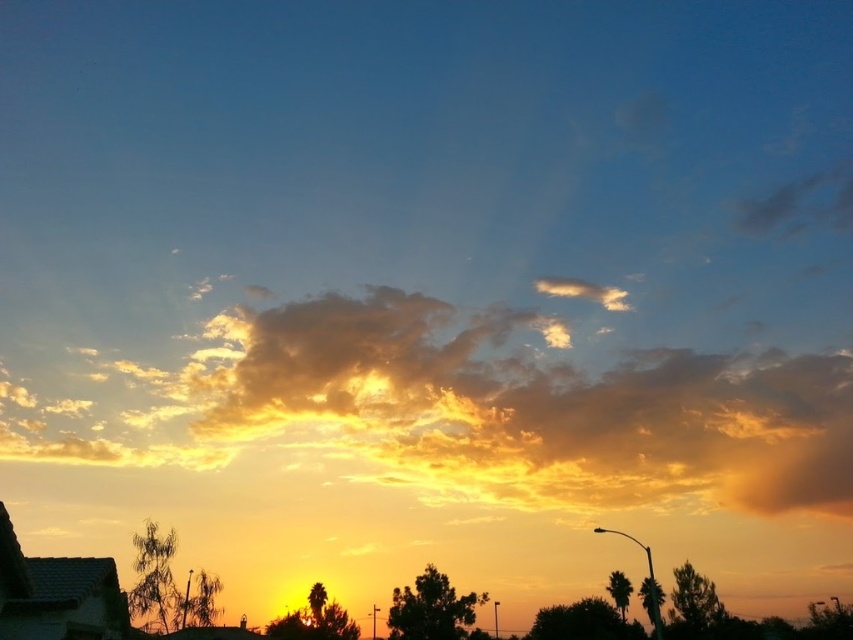
Who is positioned more to the left, golden fluffy cloud at center or cloudy cotton cloud at upper center?

Positioned to the left is golden fluffy cloud at center.

Can you confirm if golden fluffy cloud at center is bigger than cloudy cotton cloud at upper center?

Indeed, golden fluffy cloud at center has a larger size compared to cloudy cotton cloud at upper center.

The image size is (853, 640). Find the location of `golden fluffy cloud at center`. golden fluffy cloud at center is located at coordinates (496, 410).

This screenshot has height=640, width=853. I want to click on golden fluffy cloud at center, so click(x=496, y=410).